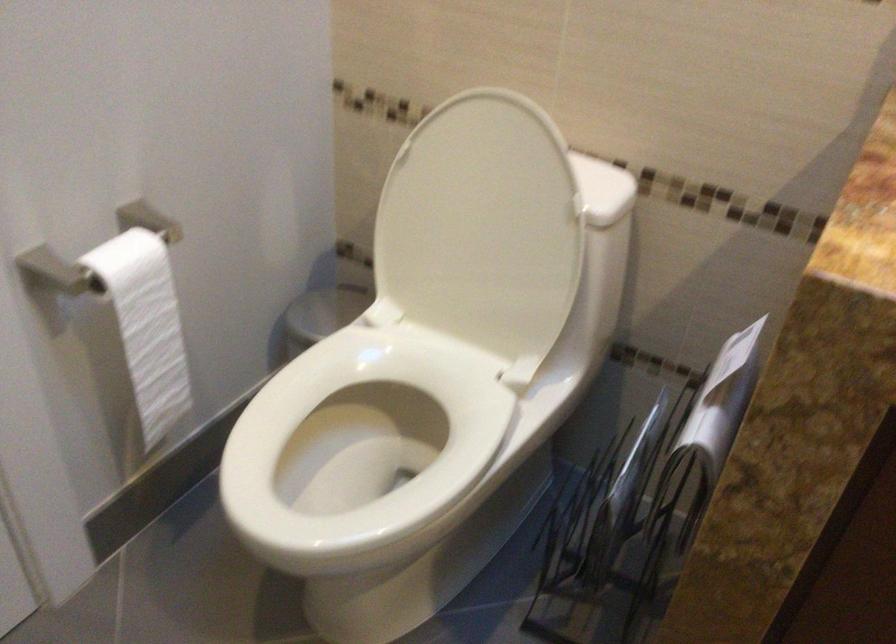
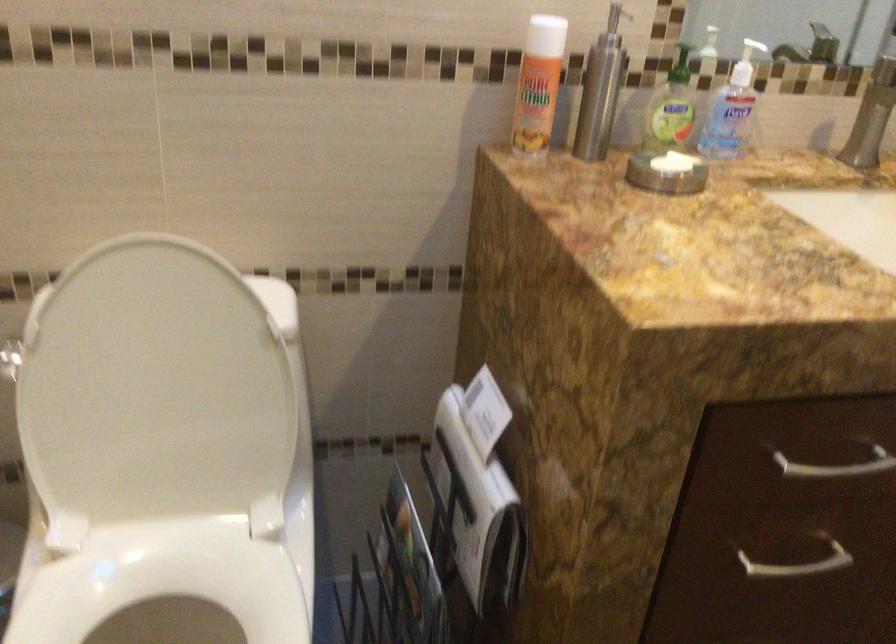
Question: The camera is either moving clockwise (left) or counter-clockwise (right) around the object. The first image is from the beginning of the video and the second image is from the end. Is the camera moving left or right when shooting the video?

Choices:
 (A) Left
 (B) Right

Answer: (A)